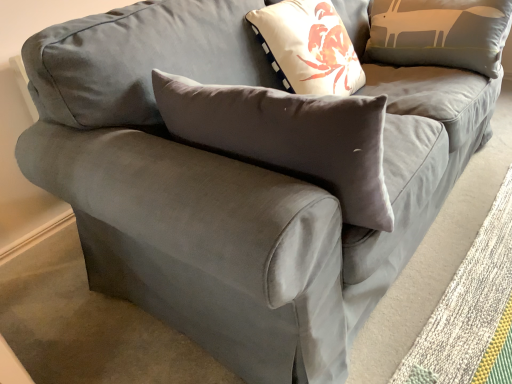
Identify the location of blank area beneath beige textured mat at lower right (from a real-world perspective). (458, 282).